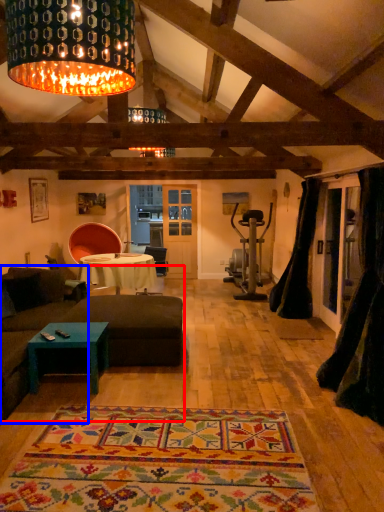
Question: Which point is further to the camera, studio couch (highlighted by a red box) or couch (highlighted by a blue box)?

Choices:
 (A) studio couch
 (B) couch

Answer: (B)